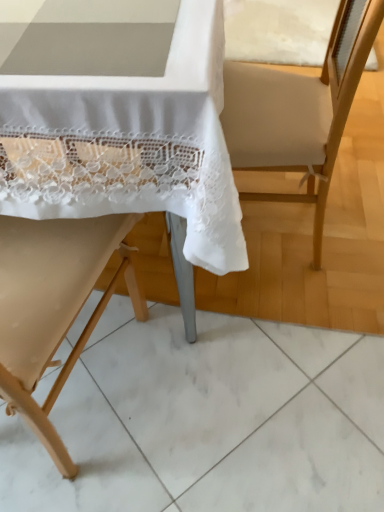
This screenshot has width=384, height=512. What are the coordinates of `vacant space underneath beige fabric armchair at center (from a real-world perspective)` in the screenshot? It's located at (273, 231).